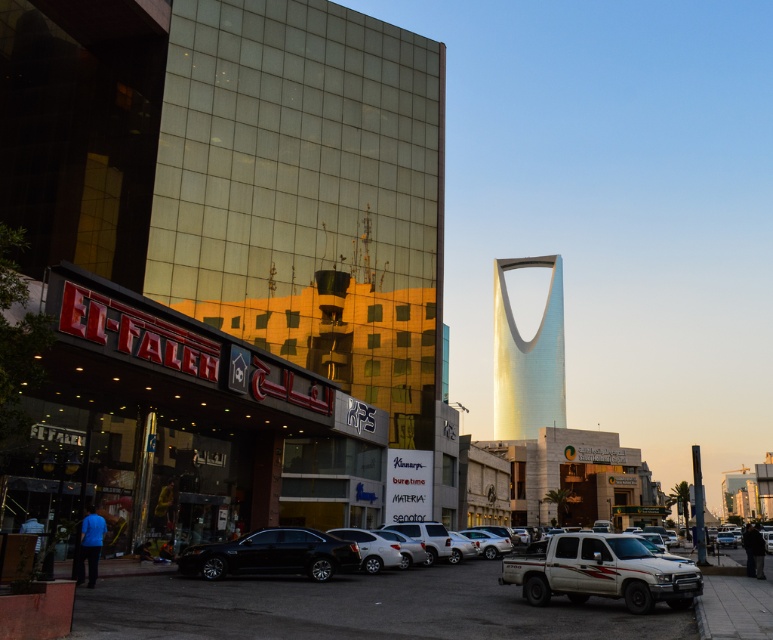
Question: Is white matte truck at lower center wider than black glossy sedan at lower center?

Choices:
 (A) no
 (B) yes

Answer: (B)

Question: Can you confirm if metallic glass building at center is bigger than white matte truck at lower center?

Choices:
 (A) no
 (B) yes

Answer: (B)

Question: Which is nearer to the metallic glass building at center?

Choices:
 (A) black glossy sedan at lower center
 (B) white matte truck at lower center

Answer: (A)

Question: Is metallic glass building at center smaller than black glossy sedan at lower center?

Choices:
 (A) no
 (B) yes

Answer: (A)

Question: Which point is closer to the camera taking this photo?

Choices:
 (A) (346, 563)
 (B) (307, 179)

Answer: (A)

Question: Estimate the real-world distances between objects in this image. Which object is farther from the white matte truck at lower center?

Choices:
 (A) black glossy sedan at lower center
 (B) metallic glass building at center

Answer: (B)